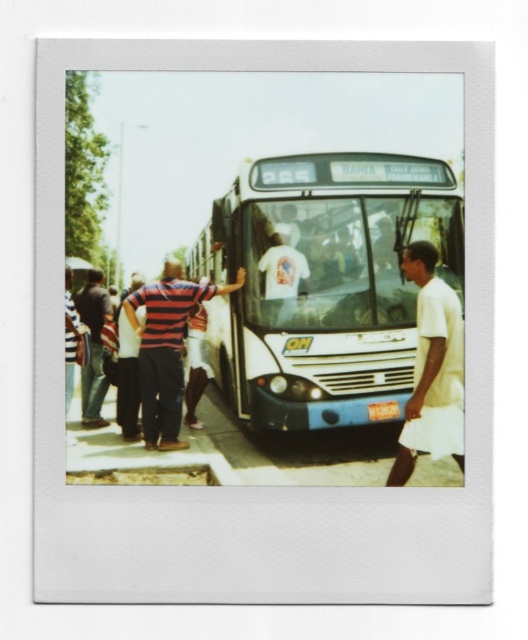
You are a pedestrian trying to cross the street near the bus stop. There is a white glossy bus at center and a white matte shirt at right. Which object is wider from your perspective?

The white glossy bus at center is wider than the white matte shirt at right.

You are a passenger trying to board the bus. You see a person in a white matte shirt at right and another in denim pants at left. Who is closer to the bus entrance?

The white matte shirt at right is in front of denim pants at left, so the person in the white matte shirt at right is closer to the bus entrance.

You are a passenger carrying a large suitcase that is 1.5 meters long. You are standing at the bus stop and want to board the white glossy bus at center. Can you carry the suitcase onto the bus without needing to check it as luggage?

The white glossy bus at center is 6.64 meters away from the viewer. Since the distance between you and the bus is 6.64 meters, you can approach the bus to board with your 1.5 meter long suitcase as the distance is sufficient to maneuver with the luggage. However, whether the suitcase fits inside the bus depends on the bus interior space which isn answerable with the given information.